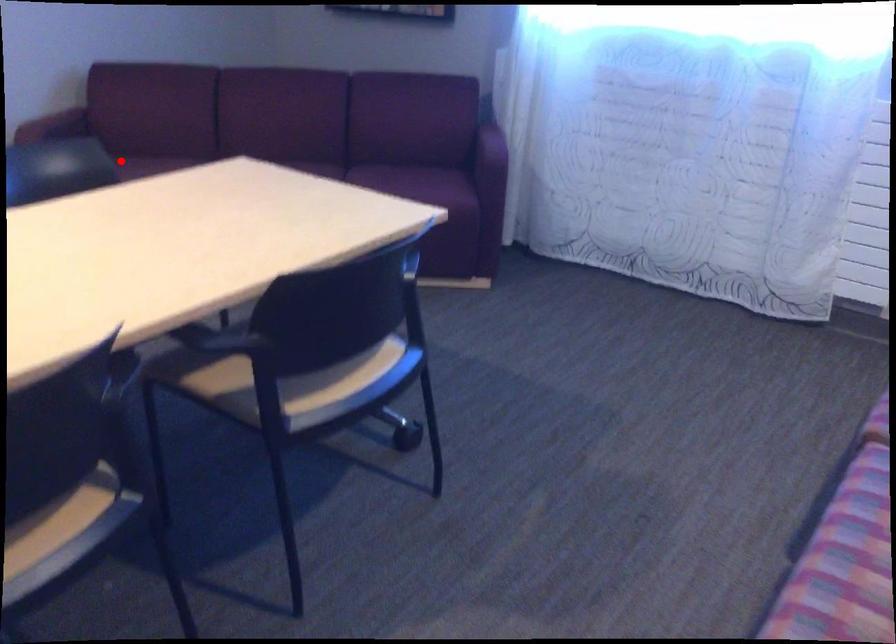
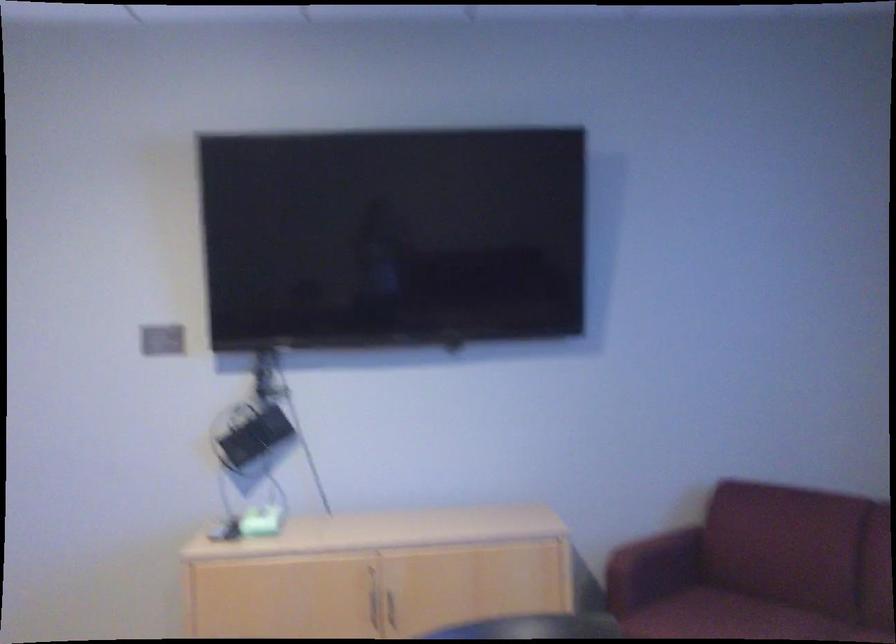
Question: I am providing you with two images of the same scene from different viewpoints. A red point is shown in image1. For the corresponding object point in image2, is it positioned nearer or farther from the camera?

Choices:
 (A) Nearer
 (B) Farther

Answer: (A)